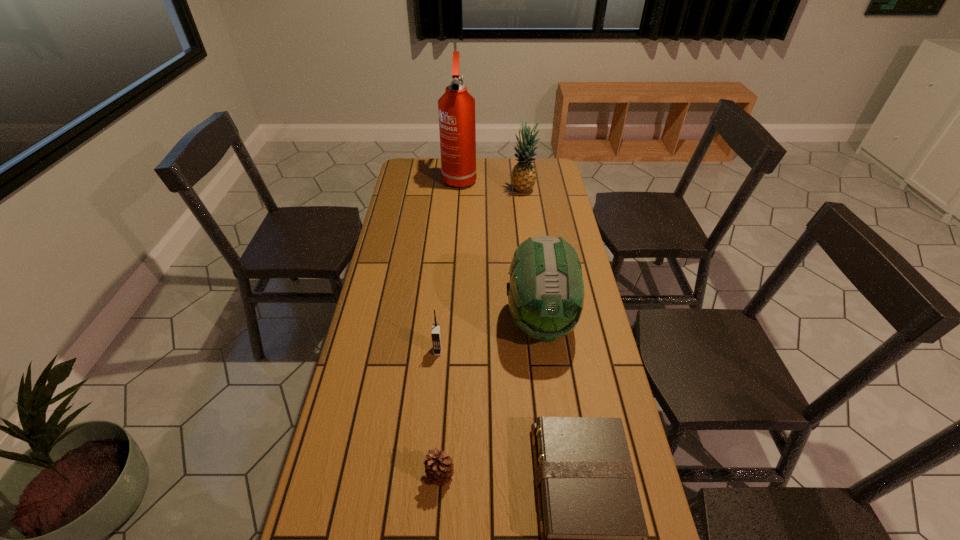
Identify the location of vacant area that lies between the football helmet and the third shortest object. This screenshot has width=960, height=540. (490, 336).

This screenshot has width=960, height=540. In order to click on empty location between the second shortest object and the cellular telephone in this screenshot , I will do `click(439, 413)`.

Find the location of a particular element. vacant area between the pineapple and the second shortest object is located at coordinates (482, 332).

Choose which object is the third nearest neighbor to the pineapple. Please provide its 2D coordinates. Your answer should be formatted as a tuple, i.e. [(x, y)], where the tuple contains the x and y coordinates of a point satisfying the conditions above.

[(436, 338)]

Find the location of `object identified as the second closest to the fire extinguisher`. object identified as the second closest to the fire extinguisher is located at coordinates (546, 290).

Where is `free space that satisfies the following two spatial constraints: 1. at the nozzle of the pineapple; 2. on the left side of the tallest object`? free space that satisfies the following two spatial constraints: 1. at the nozzle of the pineapple; 2. on the left side of the tallest object is located at coordinates (459, 190).

The width and height of the screenshot is (960, 540). In order to click on vacant space that satisfies the following two spatial constraints: 1. on the front-facing side of the pinecone; 2. on the right side of the cellular telephone in this screenshot , I will do `click(427, 475)`.